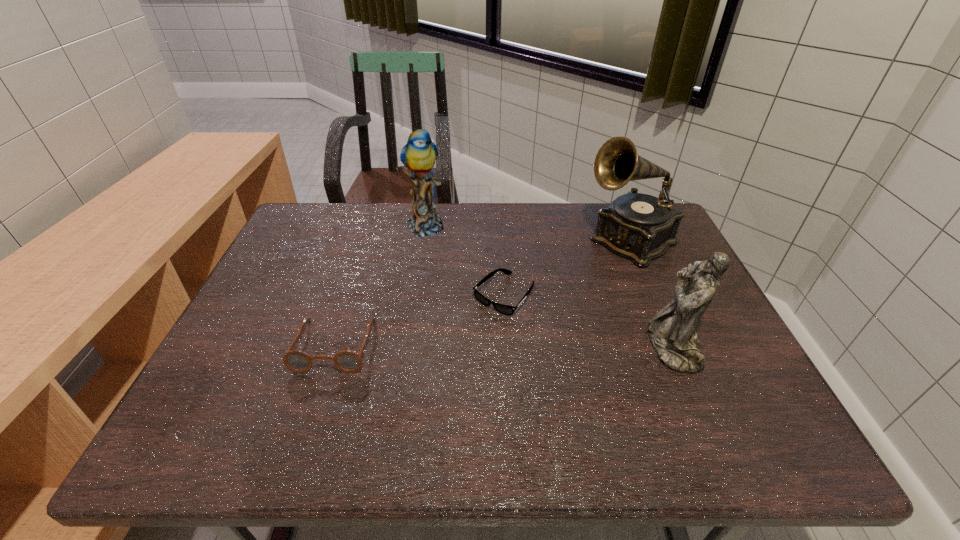
In order to click on vacant space at the near right corner in this screenshot , I will do `click(750, 407)`.

You are a GUI agent. You are given a task and a screenshot of the screen. Output one action in this format:
    pyautogui.click(x=<x>, y=<y>)
    Task: Click on the vacant point located between the third tallest object and the second object from left to right
    Image resolution: width=960 pixels, height=540 pixels.
    Given the screenshot: What is the action you would take?
    pyautogui.click(x=548, y=286)

Locate an element on the screen. free spot between the figurine and the leftmost object is located at coordinates (503, 346).

At what (x,y) coordinates should I click in order to perform the action: click on vacant point located between the third shortest object and the leftmost object. Please return your answer as a coordinate pair (x, y). This screenshot has height=540, width=960. Looking at the image, I should click on (503, 346).

Find the location of `vacant area between the second object from left to right and the phonograph record`. vacant area between the second object from left to right and the phonograph record is located at coordinates (527, 233).

Locate an element on the screen. This screenshot has width=960, height=540. free spot between the leftmost object and the phonograph record is located at coordinates (482, 293).

Locate an element on the screen. vacant region between the third object from left to right and the parrot is located at coordinates (465, 260).

The height and width of the screenshot is (540, 960). I want to click on empty space that is in between the shortest object and the phonograph record, so click(x=566, y=268).

Where is `empty space that is in between the third shortest object and the parrot`? The height and width of the screenshot is (540, 960). empty space that is in between the third shortest object and the parrot is located at coordinates (548, 286).

At what (x,y) coordinates should I click in order to perform the action: click on vacant area that lies between the shortest object and the leftmost object. Please return your answer as a coordinate pair (x, y). Looking at the image, I should click on (420, 320).